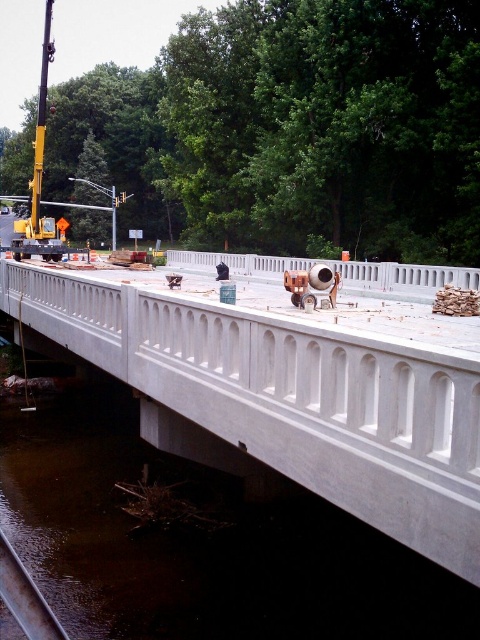
Question: Is white concrete bridge at center below metal/smooth train track at lower left?

Choices:
 (A) yes
 (B) no

Answer: (B)

Question: Is white concrete bridge at center to the right of metal/smooth train track at lower left from the viewer's perspective?

Choices:
 (A) yes
 (B) no

Answer: (B)

Question: Which point appears farthest from the camera in this image?

Choices:
 (A) (448, 561)
 (B) (36, 621)

Answer: (A)

Question: Which object appears closest to the camera in this image?

Choices:
 (A) metal/smooth train track at lower left
 (B) white concrete bridge at center

Answer: (A)

Question: Observing the image, what is the correct spatial positioning of white concrete bridge at center in reference to metal/smooth train track at lower left?

Choices:
 (A) below
 (B) above

Answer: (B)